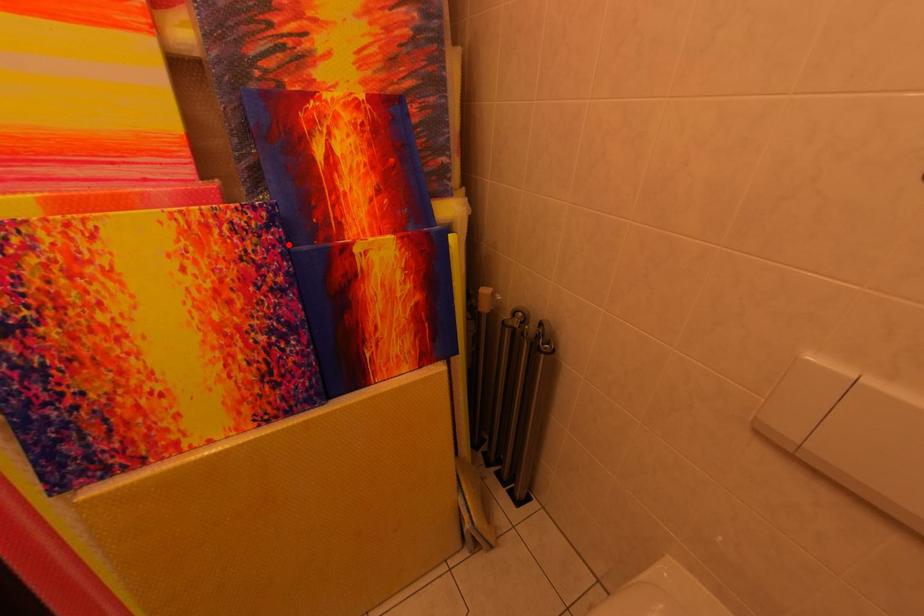
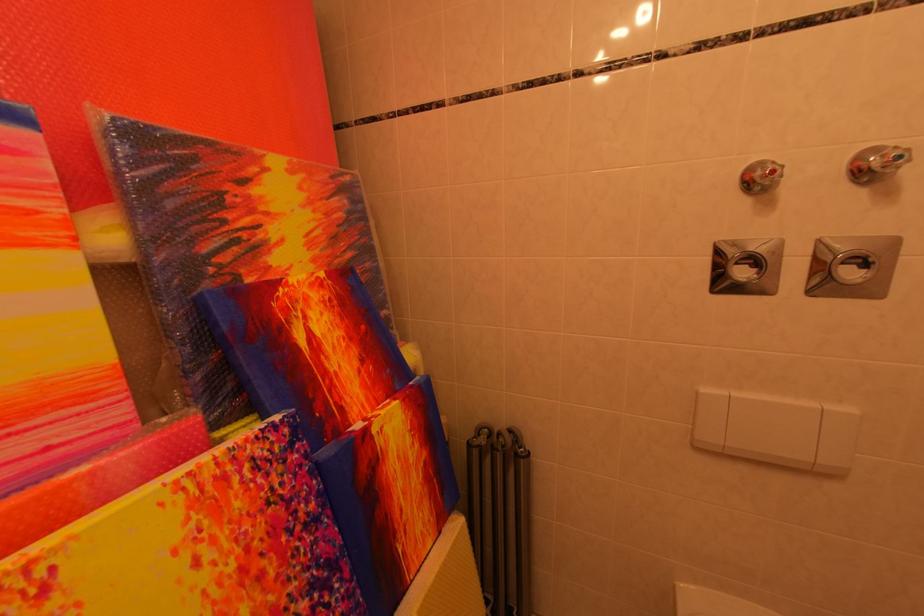
Locate, in the second image, the point that corresponds to the highlighted location in the first image.

(313, 460)